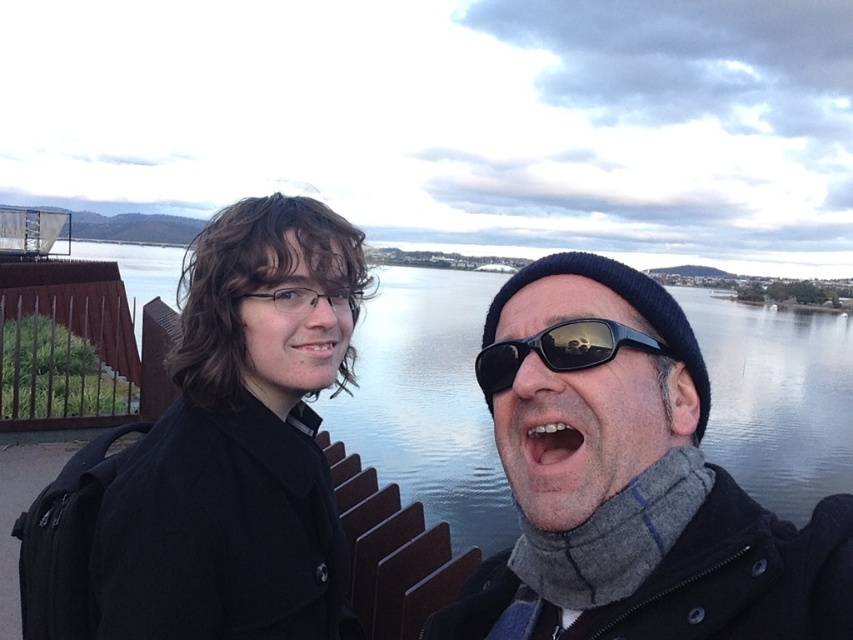
You are a photographer trying to capture a clear shot of the matte black coat at center and the matte black sunglasses at center. Since both are matte black, you want to ensure you can distinguish them in the photo. Based on their sizes, which object should appear larger in your photo?

The matte black coat at center should appear larger in the photo because it has a greater height compared to the matte black sunglasses at center.

You are standing in a park and see the matte black coat at center in the distance. If you want to reach the coat, how many steps of 2 feet each would you need to take to get there?

The distance between you and the matte black coat at center is 8.66 feet. Since each step covers 2 feet, you would need to take approximately 4.33 steps. Since you can only take whole steps, you would need to take 5 steps to reach the coat.

You are a photographer standing 5 feet away from the black reflective sunglasses at center. You want to take a clear photo of the sunglasses without any glare. Since the sunglasses are reflective, you need to adjust your position. Should you move closer or farther away from the sunglasses to reduce glare?

The black reflective sunglasses at center is 6.08 feet away from the camera. Since you are currently 5 feet away, you are closer than the optimal distance. To reduce glare from reflective surfaces, moving farther away can help minimize reflections. Therefore, you should move farther away from the sunglasses to reduce glare.